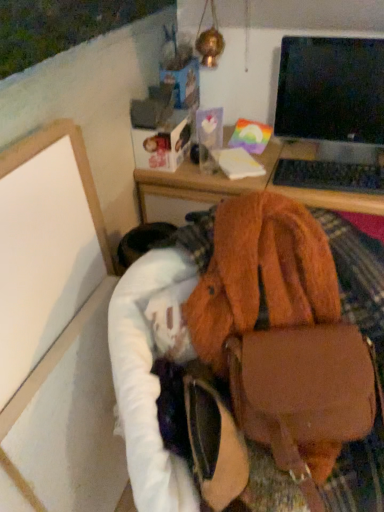
Question: Choose the correct answer: Is black plastic keyboard at upper right inside black glossy monitor at upper right or outside it?

Choices:
 (A) outside
 (B) inside

Answer: (A)

Question: In terms of height, does black plastic keyboard at upper right look taller or shorter compared to black glossy monitor at upper right?

Choices:
 (A) short
 (B) tall

Answer: (A)

Question: Which is nearer to the black glossy monitor at upper right?

Choices:
 (A) black plastic keyboard at upper right
 (B) brown leather handbag at lower right
 (C) white matte board at lower left

Answer: (A)

Question: Based on their relative distances, which object is farther from the black glossy monitor at upper right?

Choices:
 (A) black plastic keyboard at upper right
 (B) white matte board at lower left
 (C) brown leather handbag at lower right

Answer: (B)